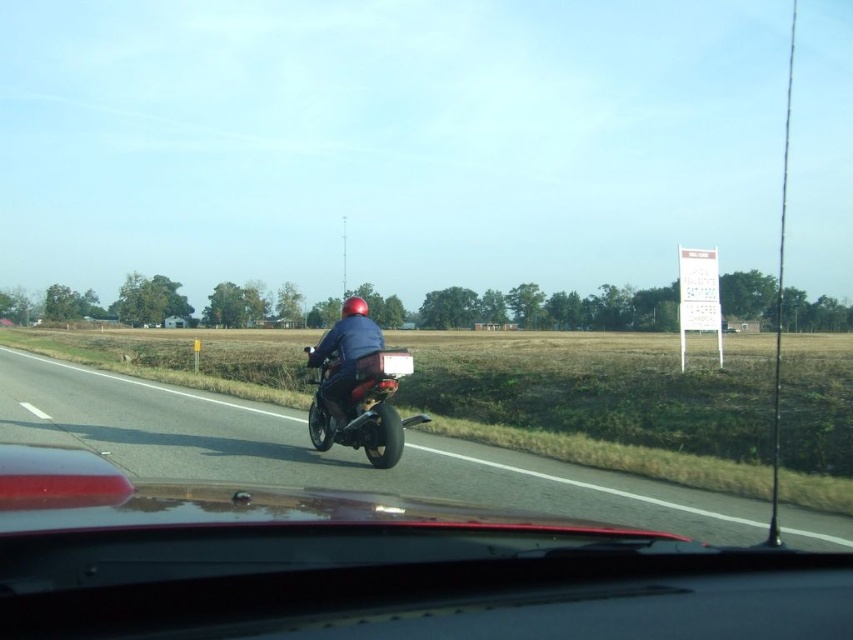
You are a passenger in the car and notice the shiny black motorcycle at center. Based on its position coordinates, can you determine if it is closer to the front or the back of the car?

A: The shiny black motorcycle at center is located at point coordinates, which indicates it is closer to the front of the car since the coordinates suggest it is positioned near the center of the windshield view.

You are inside a car and want to know how far the point at coordinates (202,428) is from your current position. Can you determine this distance?

The distance between point (202,428) and the camera is 41.01 feet, so the point is 41.01 feet away from your current position inside the car.